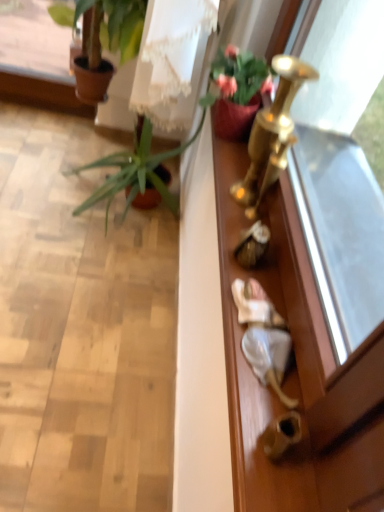
Question: From a real-world perspective, is matte pink pot at upper right, positioned as the 3th houseplant in back-to-front order, positioned over green matte plant at upper left, marked as the second houseplant in a back-to-front arrangement, based on gravity?

Choices:
 (A) yes
 (B) no

Answer: (A)

Question: Considering the relative positions of matte pink pot at upper right, the 1th houseplant from the front, and green matte plant at upper left, the second houseplant positioned from the front, in the image provided, is matte pink pot at upper right, the 1th houseplant from the front, in front of green matte plant at upper left, the second houseplant positioned from the front,?

Choices:
 (A) yes
 (B) no

Answer: (A)

Question: Can you confirm if matte pink pot at upper right, positioned as the 3th houseplant in back-to-front order, is bigger than green matte plant at upper left, the second houseplant positioned from the front?

Choices:
 (A) no
 (B) yes

Answer: (A)

Question: Does matte pink pot at upper right, positioned as the 3th houseplant in back-to-front order, appear on the right side of green matte plant at upper left, the second houseplant positioned from the front?

Choices:
 (A) no
 (B) yes

Answer: (B)

Question: Is matte pink pot at upper right, the 1th houseplant from the front, behind green matte plant at upper left, marked as the second houseplant in a back-to-front arrangement?

Choices:
 (A) no
 (B) yes

Answer: (A)

Question: Considering the relative sizes of matte pink pot at upper right, the 1th houseplant from the front, and green matte plant at upper left, marked as the second houseplant in a back-to-front arrangement, in the image provided, is matte pink pot at upper right, the 1th houseplant from the front, thinner than green matte plant at upper left, marked as the second houseplant in a back-to-front arrangement,?

Choices:
 (A) no
 (B) yes

Answer: (B)

Question: From the image's perspective, does green matte plant at upper left, marked as the second houseplant in a back-to-front arrangement, appear lower than matte pink pot at upper right, the 1th houseplant from the front?

Choices:
 (A) yes
 (B) no

Answer: (B)

Question: Is green matte plant at upper left, marked as the second houseplant in a back-to-front arrangement, thinner than matte pink pot at upper right, the 1th houseplant from the front?

Choices:
 (A) no
 (B) yes

Answer: (A)

Question: Does green matte plant at upper left, marked as the second houseplant in a back-to-front arrangement, contain matte pink pot at upper right, the 1th houseplant from the front?

Choices:
 (A) yes
 (B) no

Answer: (B)

Question: From a real-world perspective, is green matte plant at upper left, marked as the second houseplant in a back-to-front arrangement, on matte pink pot at upper right, positioned as the 3th houseplant in back-to-front order?

Choices:
 (A) no
 (B) yes

Answer: (A)

Question: Can you confirm if green matte plant at upper left, marked as the second houseplant in a back-to-front arrangement, is wider than matte pink pot at upper right, positioned as the 3th houseplant in back-to-front order?

Choices:
 (A) yes
 (B) no

Answer: (A)

Question: From the image's perspective, does green matte plant at upper left, marked as the second houseplant in a back-to-front arrangement, appear higher than matte pink pot at upper right, the 1th houseplant from the front?

Choices:
 (A) no
 (B) yes

Answer: (B)

Question: Is there a large distance between gold metallic screen door at right and green leafy plant at left, placed as the first houseplant when sorted from back to front?

Choices:
 (A) yes
 (B) no

Answer: (B)